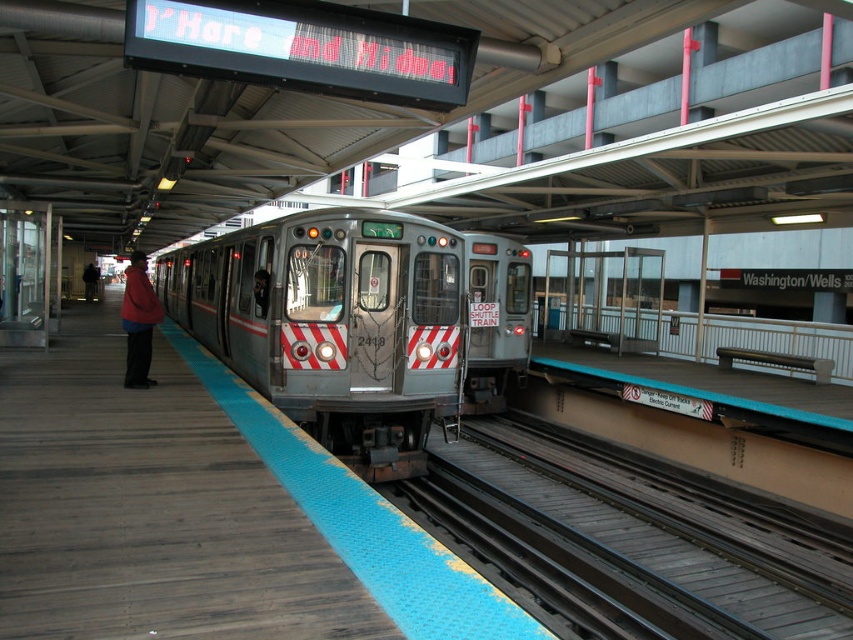
The image size is (853, 640). In order to click on wooden platform at center in this screenshot , I will do `click(149, 509)`.

Is point (167, 593) positioned behind point (288, 358)?

No, it is in front of (288, 358).

Looking at this image, who is more distant from viewer, (x=131, y=570) or (x=347, y=305)?

The point (x=347, y=305) is more distant.

Image resolution: width=853 pixels, height=640 pixels. In order to click on wooden platform at center in this screenshot , I will do `click(149, 509)`.

Does point (109, 513) lie behind point (137, 330)?

That is False.

Does wooden platform at center have a smaller size compared to matte red jacket at left?

Yes.

Between point (38, 490) and point (144, 362), which one is positioned behind?

Point (144, 362)

You are a GUI agent. You are given a task and a screenshot of the screen. Output one action in this format:
    pyautogui.click(x=<x>, y=<y>)
    Task: Click on the wooden platform at center
    The image size is (853, 640).
    Given the screenshot: What is the action you would take?
    pyautogui.click(x=149, y=509)

Which is more to the left, black metal train track at lower center or matte red jacket at left?

matte red jacket at left

Who is lower down, black metal train track at lower center or matte red jacket at left?

black metal train track at lower center is below.

This screenshot has height=640, width=853. I want to click on black metal train track at lower center, so click(625, 541).